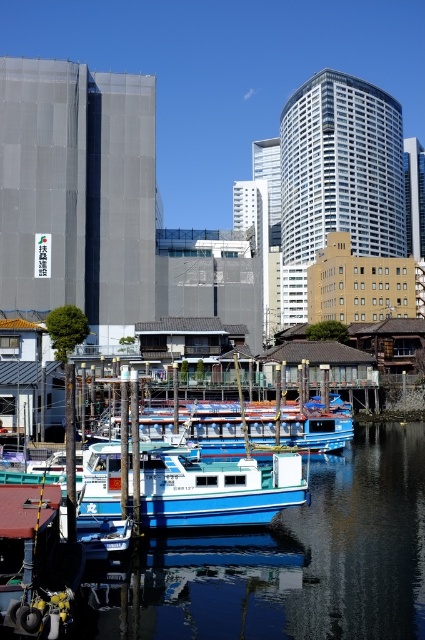
You are a photographer standing on the pier and want to capture both the blue glossy boat at center and the blue matte boat at center in a single shot. Which boat should you position closer to the camera to ensure both are visible without moving the camera?

The blue glossy boat at center is below the blue matte boat at center, so positioning the blue glossy boat closer to the camera will ensure both are visible in the shot.

You are a photographer planning to take a photo of the blue matte boat at center and the blue wooden boat at center from the pier. Which boat will appear taller in the photo?

The blue matte boat at center will appear taller in the photo because it is taller than the blue wooden boat at center according to the description.

You are standing at the camera position and want to take a photo of the blue matte boat at center. The camera has a maximum range of 50 meters. Will you be able to capture the boat in your photo?

The blue matte boat at center and camera are 46.80 meters apart from each other. Since the camera can capture up to 50 meters, you can take the photo.